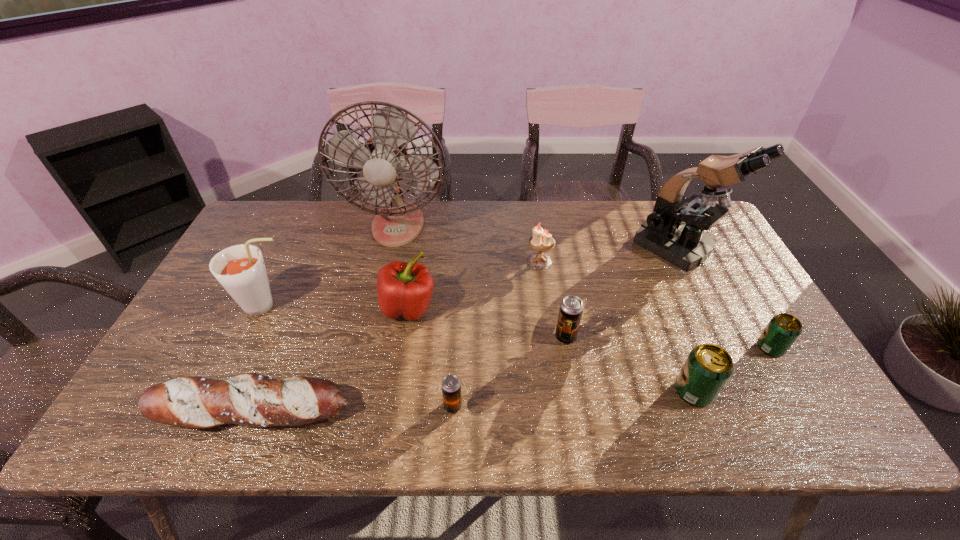
Where is `the smaller green beer can`? The width and height of the screenshot is (960, 540). the smaller green beer can is located at coordinates (783, 329).

Identify the location of the leftmost beer can. The width and height of the screenshot is (960, 540). (451, 386).

In order to click on the sixth object from right to left in this screenshot , I will do tap(451, 386).

Where is `baguet`? The width and height of the screenshot is (960, 540). baguet is located at coordinates (250, 399).

Where is `vacant area situated 0.160m in front of the fan to direct airflow`? Image resolution: width=960 pixels, height=540 pixels. vacant area situated 0.160m in front of the fan to direct airflow is located at coordinates (384, 287).

I want to click on free region located 0.340m on the left of the microscope, so click(527, 248).

Where is `vacant region located 0.230m on the drink side of the root beer`? Image resolution: width=960 pixels, height=540 pixels. vacant region located 0.230m on the drink side of the root beer is located at coordinates (379, 306).

Locate an element on the screen. This screenshot has width=960, height=540. vacant area located on the right of the candle holder is located at coordinates (638, 261).

I want to click on free region located on the back of the pink bell pepper, so click(416, 260).

In order to click on vacant space located 0.310m on the left of the nearer green beer can in this screenshot , I will do `click(540, 392)`.